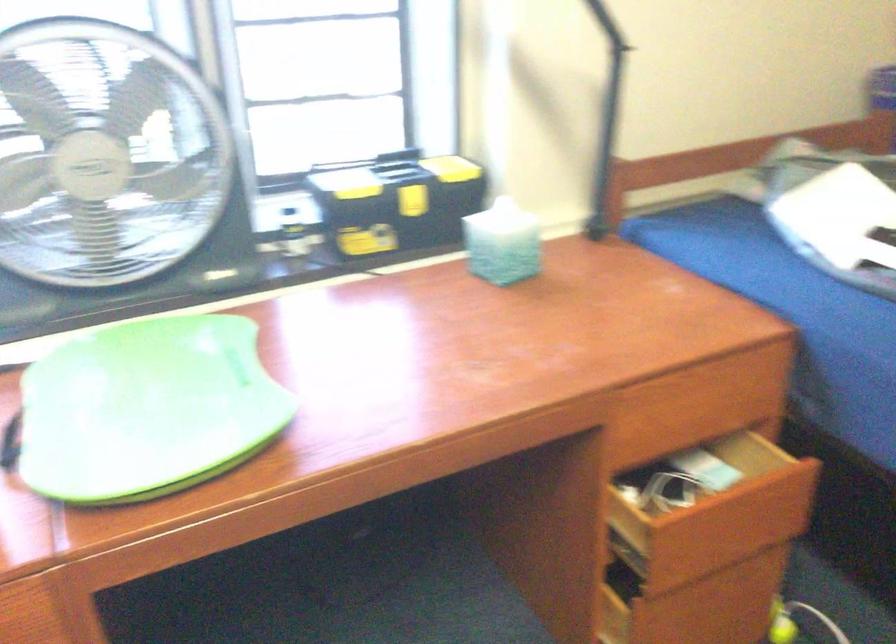
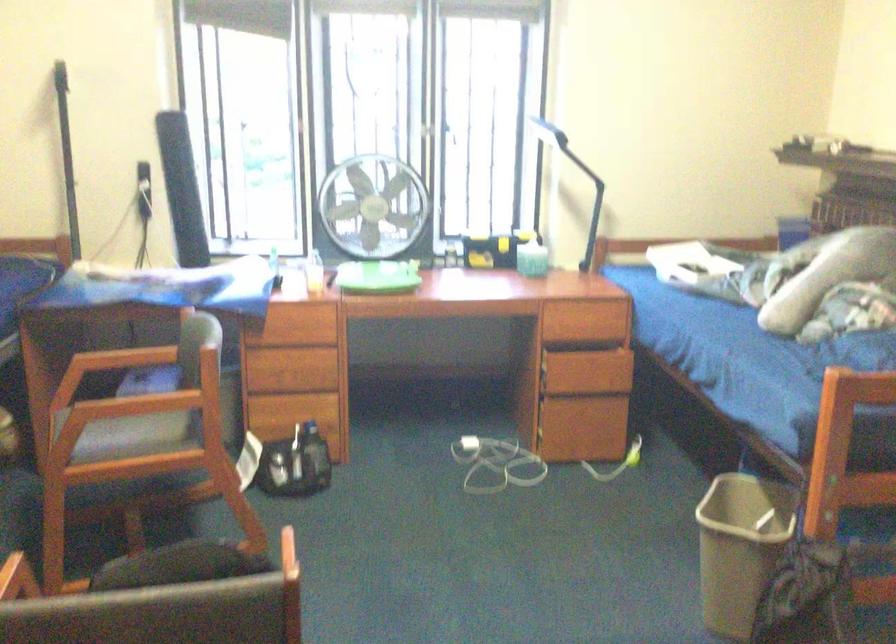
Find the pixel in the second image that matches [709,410] in the first image.

(596, 319)